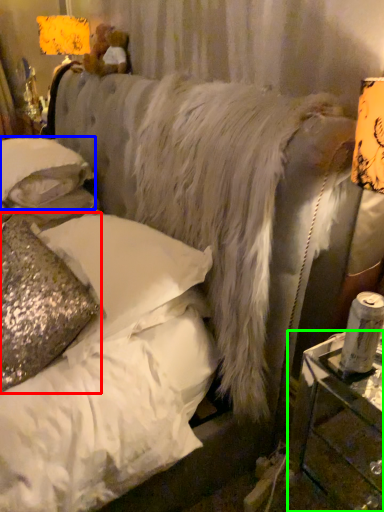
Question: Based on their relative distances, which object is farther from pillow (highlighted by a red box)? Choose from pillow (highlighted by a blue box) and table (highlighted by a green box).

Choices:
 (A) pillow
 (B) table

Answer: (B)